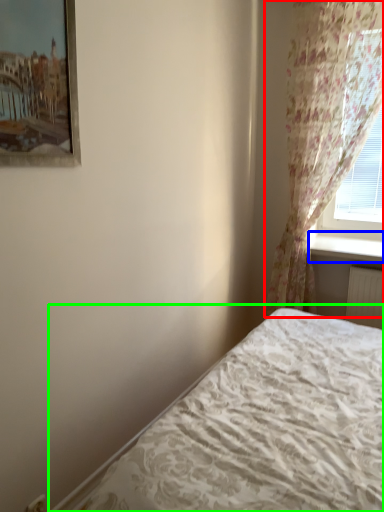
Question: Which object is the closest to the curtain (highlighted by a red box)? Choose among these: window sill (highlighted by a blue box) or bed (highlighted by a green box).

Choices:
 (A) window sill
 (B) bed

Answer: (A)